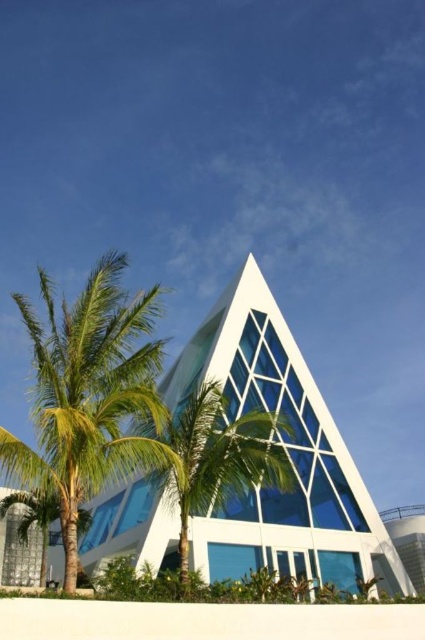
You are standing at the entrance of the transparent glass chapel at center and want to look up at the green leafy palm tree at left. Is the palm tree above or below the chapel?

The transparent glass chapel at center is located below green leafy palm tree at left, so the palm tree is above the chapel.

You are standing in front of the modern building with two palm trees framing the entrance. You notice two points marked on the ground at coordinates point [93,307] and point [176,426]. If you were to walk towards both points simultaneously, which point would you reach first?

You would reach point [93,307] first because it is closer to you than point [176,426].